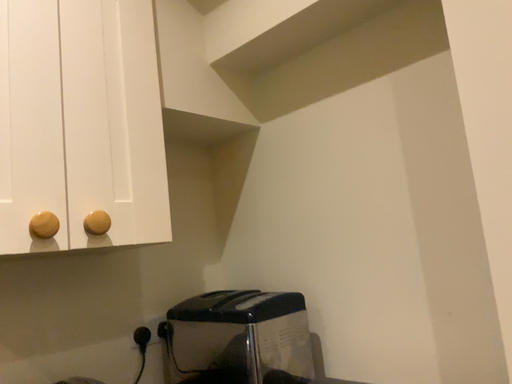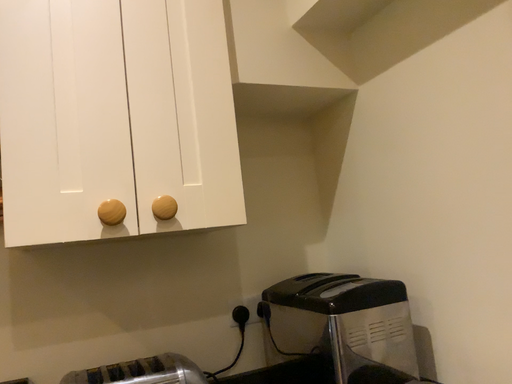
Question: How did the camera likely rotate when shooting the video?

Choices:
 (A) rotated right
 (B) rotated left

Answer: (B)